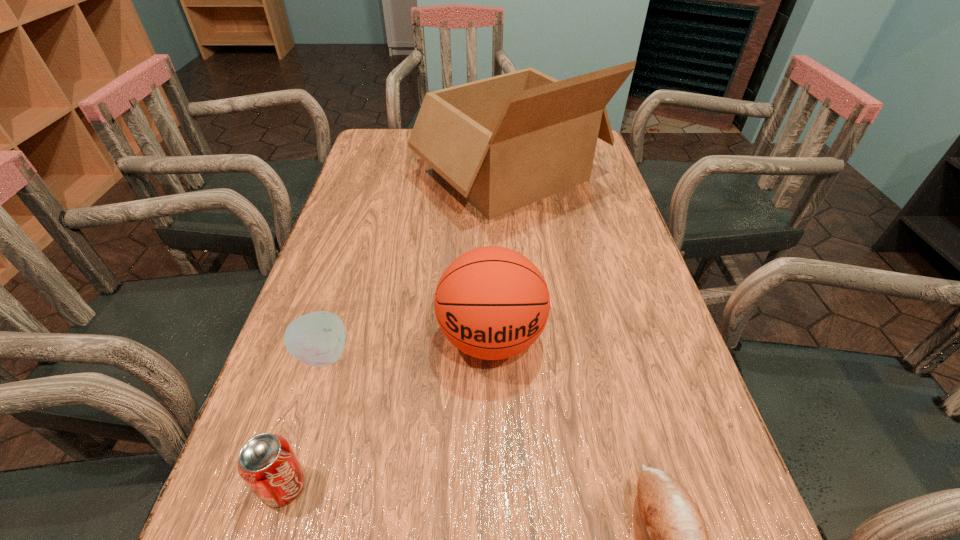
Find the location of a particular element. soda can present at the left edge is located at coordinates (267, 463).

Find the location of `apple that is at the left edge`. apple that is at the left edge is located at coordinates (317, 339).

Locate an element on the screen. The image size is (960, 540). object that is at the right edge is located at coordinates (504, 142).

This screenshot has height=540, width=960. I want to click on object at the far right corner, so click(x=504, y=142).

What are the coordinates of `vacant space at the left edge of the desktop` in the screenshot? It's located at (361, 361).

Image resolution: width=960 pixels, height=540 pixels. I want to click on free region at the right edge, so click(x=623, y=459).

Find the location of a particular element. unoccupied area between the second tallest object and the apple is located at coordinates (407, 347).

The image size is (960, 540). Identify the location of free space between the apple and the basketball. (407, 347).

This screenshot has height=540, width=960. I want to click on free spot between the soda can and the fourth shortest object, so click(x=388, y=412).

This screenshot has width=960, height=540. I want to click on object that stands as the closest to the hamster, so click(492, 303).